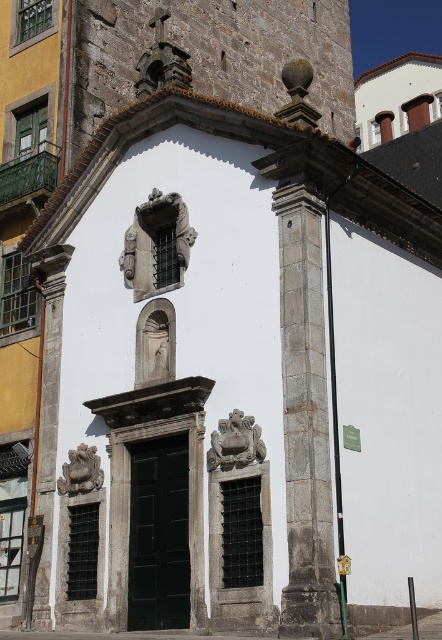
Question: Which point appears farthest from the camera in this image?

Choices:
 (A) (84, 467)
 (B) (294, 525)

Answer: (A)

Question: Can you confirm if gray stone column at center is thinner than carved stone statue at center?

Choices:
 (A) yes
 (B) no

Answer: (A)

Question: Is the position of smooth stone column at left less distant than that of carved stone statue at center?

Choices:
 (A) yes
 (B) no

Answer: (B)

Question: Observing the image, what is the correct spatial positioning of gray stone column at center in reference to stone carved lion at lower left?

Choices:
 (A) left
 (B) right

Answer: (B)

Question: Which of these objects is positioned farthest from the stone carved lion at lower left?

Choices:
 (A) smooth stone column at left
 (B) gray stone column at center

Answer: (B)

Question: Which of these objects is positioned closest to the gray stone column at center?

Choices:
 (A) stone carved lion at lower left
 (B) smooth stone column at left

Answer: (A)